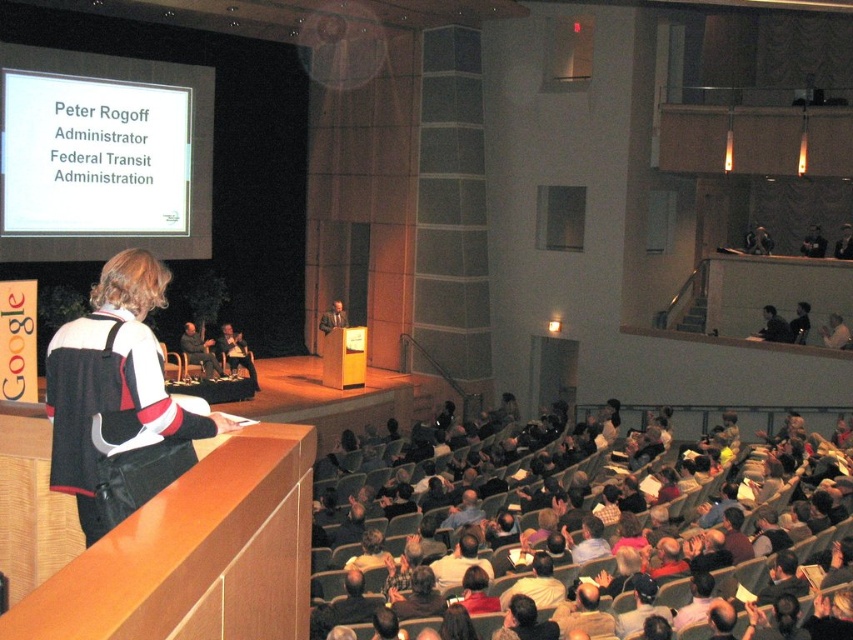
Question: Does dark gray fabric chair at center have a smaller size compared to dark gray suit at center?

Choices:
 (A) yes
 (B) no

Answer: (B)

Question: Can you confirm if dark gray fabric chair at center is positioned above matte black podium at center?

Choices:
 (A) no
 (B) yes

Answer: (A)

Question: Is dark gray fabric chair at center closer to camera compared to dark gray suit at center?

Choices:
 (A) no
 (B) yes

Answer: (A)

Question: Which point appears closest to the camera in this image?

Choices:
 (A) (199, 333)
 (B) (325, 323)
 (C) (238, 336)

Answer: (A)

Question: Among these points, which one is farthest from the camera?

Choices:
 (A) (248, 376)
 (B) (341, 314)

Answer: (B)

Question: Among these objects, which one is farthest from the camera?

Choices:
 (A) dark gray fabric chair at center
 (B) dark gray suit at center

Answer: (A)